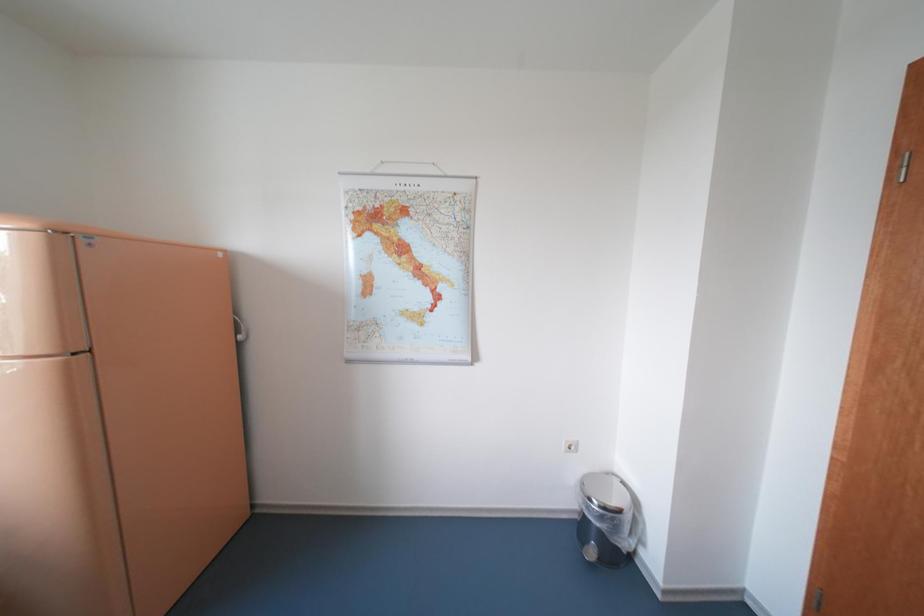
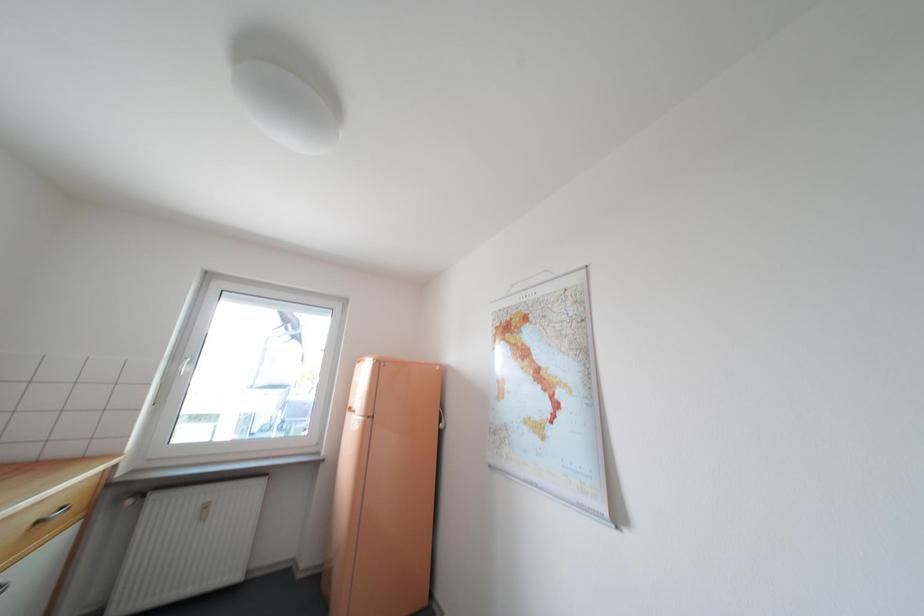
From the picture: The first image is from the beginning of the video and the second image is from the end. How did the camera likely rotate when shooting the video?

The camera rotated toward left-up.